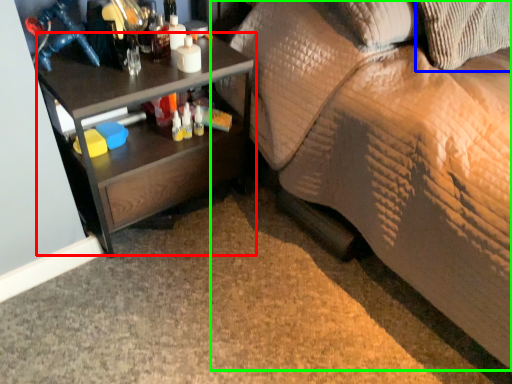
Question: Estimate the real-world distances between objects in this image. Which object is closer to desk (highlighted by a red box), pillow (highlighted by a blue box) or studio couch (highlighted by a green box)?

Choices:
 (A) pillow
 (B) studio couch

Answer: (B)